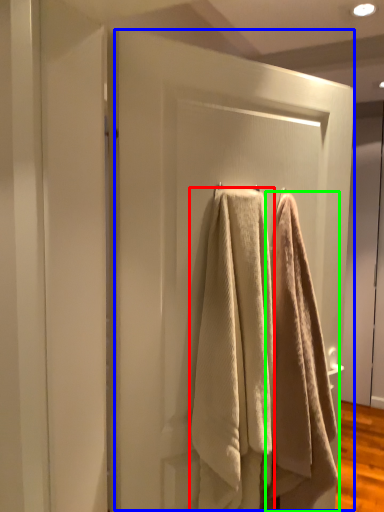
Question: Which object is the farthest from towel (highlighted by a red box)? Choose among these: screen door (highlighted by a blue box) or towel (highlighted by a green box).

Choices:
 (A) screen door
 (B) towel

Answer: (A)